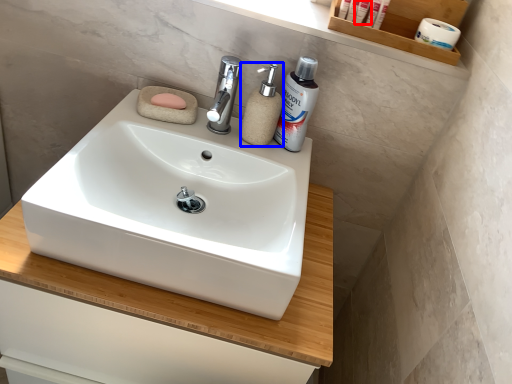
Question: Which point is closer to the camera, personal care (highlighted by a red box) or soap dispenser (highlighted by a blue box)?

Choices:
 (A) personal care
 (B) soap dispenser

Answer: (B)